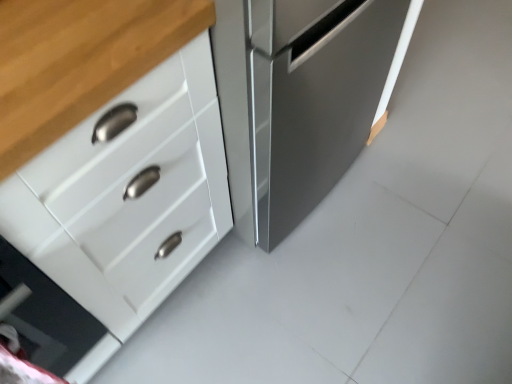
What do you see at coordinates (115, 212) in the screenshot?
I see `white glossy cabinet at left` at bounding box center [115, 212].

What are the coordinates of `white glossy cabinet at left` in the screenshot? It's located at (115, 212).

The image size is (512, 384). In order to click on white glossy cabinet at left in this screenshot , I will do `click(115, 212)`.